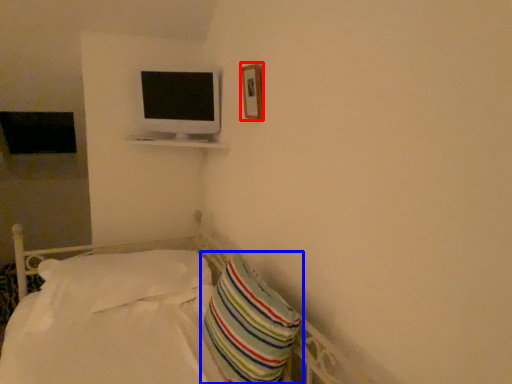
Question: Among these objects, which one is farthest to the camera, picture frame (highlighted by a red box) or pillow (highlighted by a blue box)?

Choices:
 (A) picture frame
 (B) pillow

Answer: (A)